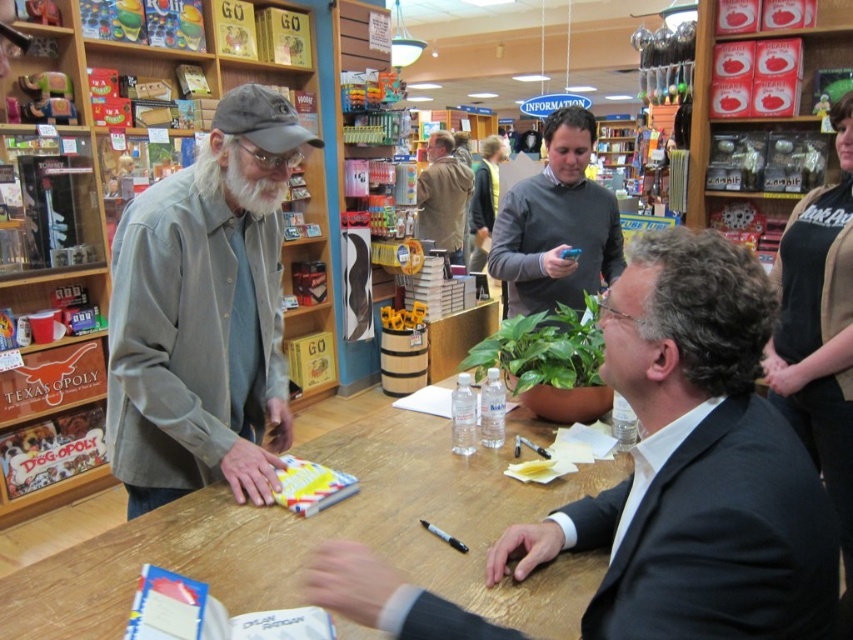
How much distance is there between dark gray suit at center and dark gray sweater at center?

A distance of 5.04 meters exists between dark gray suit at center and dark gray sweater at center.

Is dark gray suit at center wider than dark gray sweater at center?

Correct, the width of dark gray suit at center exceeds that of dark gray sweater at center.

What do you see at coordinates (695, 465) in the screenshot? The image size is (853, 640). I see `dark gray suit at center` at bounding box center [695, 465].

Identify the location of dark gray suit at center. This screenshot has width=853, height=640. (695, 465).

Which is above, wooden table at center or black cotton shirt at upper right?

black cotton shirt at upper right is higher up.

Is wooden table at center wider than black cotton shirt at upper right?

Yes, wooden table at center is wider than black cotton shirt at upper right.

The width and height of the screenshot is (853, 640). What are the coordinates of `wooden table at center` in the screenshot? It's located at (328, 534).

Between dark gray suit at center and gray cotton shirt at left, which one has less height?

dark gray suit at center is shorter.

Does dark gray suit at center have a lesser width compared to gray cotton shirt at left?

No.

Is point (788, 472) closer to viewer compared to point (119, 252)?

Yes, point (788, 472) is in front of point (119, 252).

I want to click on dark gray suit at center, so click(x=695, y=465).